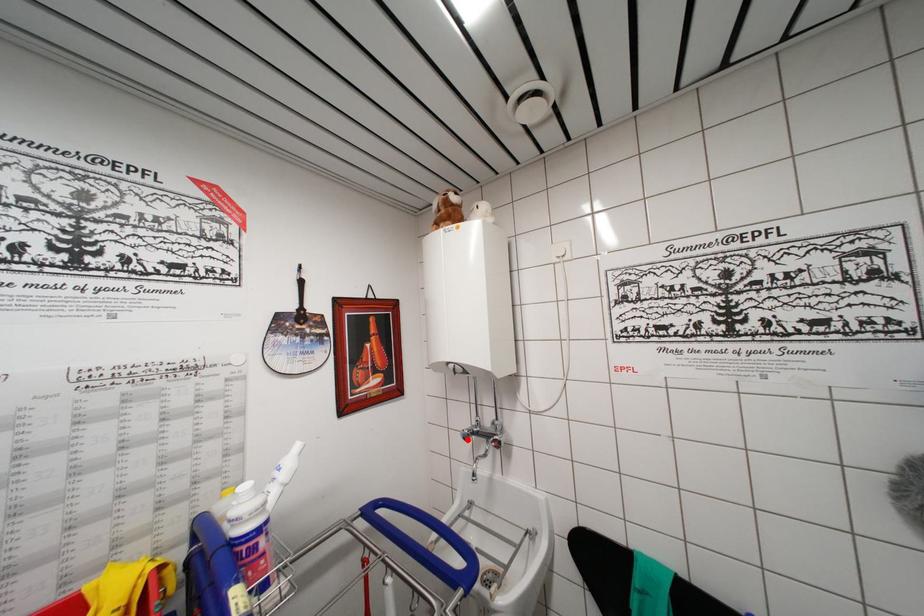
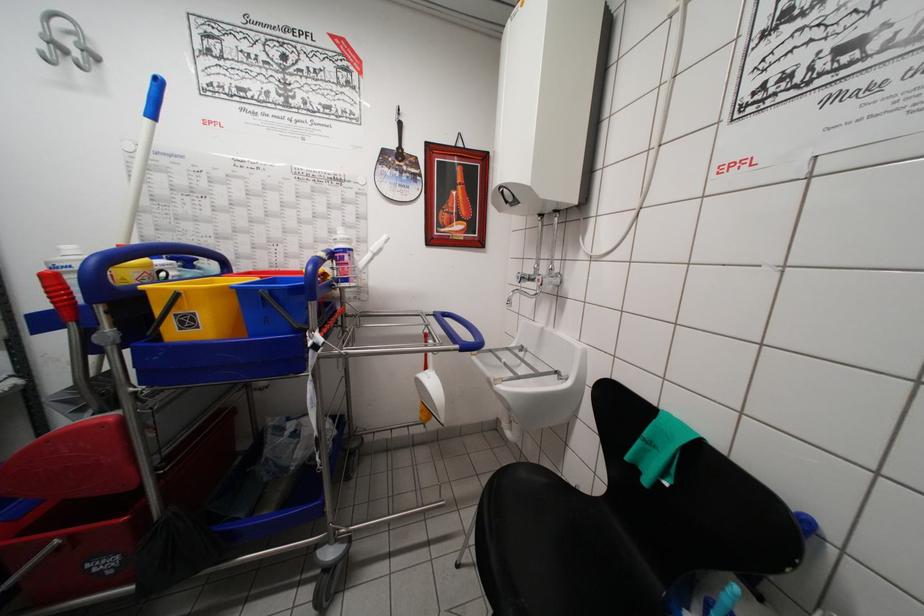
Question: I am providing you with two images of the same scene from different viewpoints. In image1, a red point is highlighted. Considering the same 3D point in image2, which of the following is correct?

Choices:
 (A) It is closer
 (B) It is farther

Answer: (A)